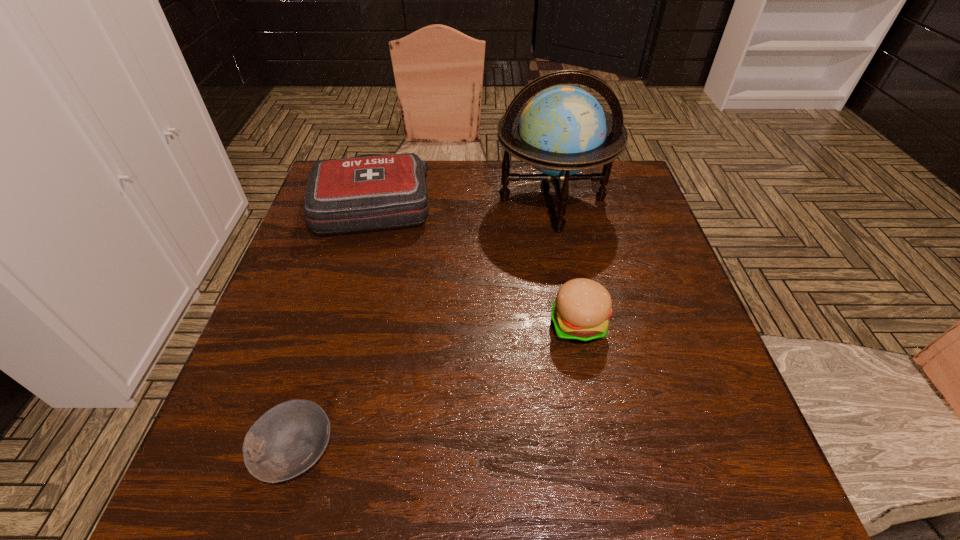
Where is `the first-aid kit located at the far edge`? This screenshot has width=960, height=540. the first-aid kit located at the far edge is located at coordinates (373, 191).

Where is `object at the near edge`? object at the near edge is located at coordinates (288, 439).

Identify the location of the first-aid kit that is at the left edge. (373, 191).

Identify the location of bowl situated at the left edge. (288, 439).

You are a GUI agent. You are given a task and a screenshot of the screen. Output one action in this format:
    pyautogui.click(x=<x>, y=<y>)
    Task: Click on the object at the right edge
    
    Given the screenshot: What is the action you would take?
    pyautogui.click(x=563, y=130)

The image size is (960, 540). I want to click on object at the far left corner, so click(x=373, y=191).

Locate an element on the screen. This screenshot has width=960, height=540. object that is at the near left corner is located at coordinates (288, 439).

Locate an element on the screen. The height and width of the screenshot is (540, 960). object situated at the far right corner is located at coordinates (563, 130).

Identify the location of free space at the far edge. (429, 180).

This screenshot has height=540, width=960. I want to click on vacant region at the near edge, so tap(422, 498).